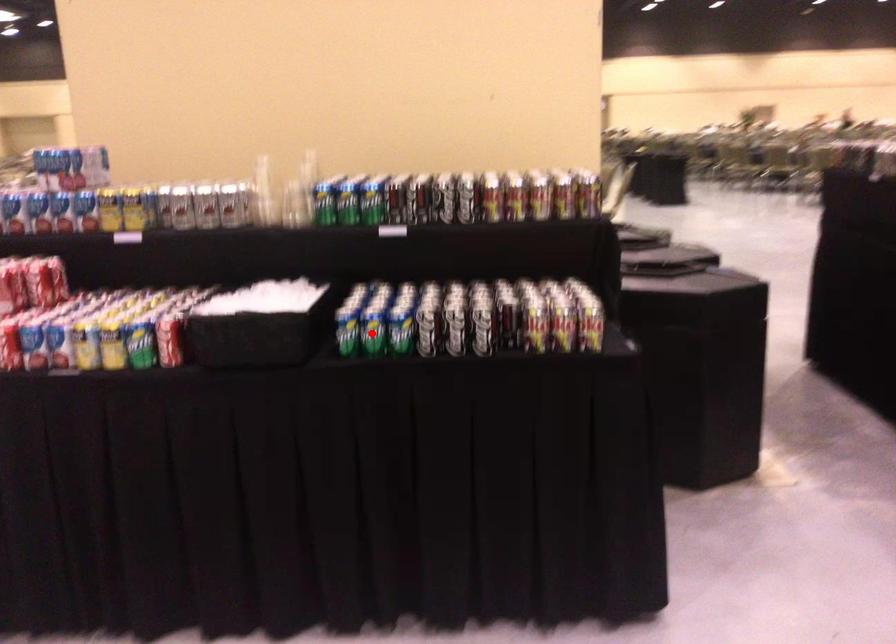
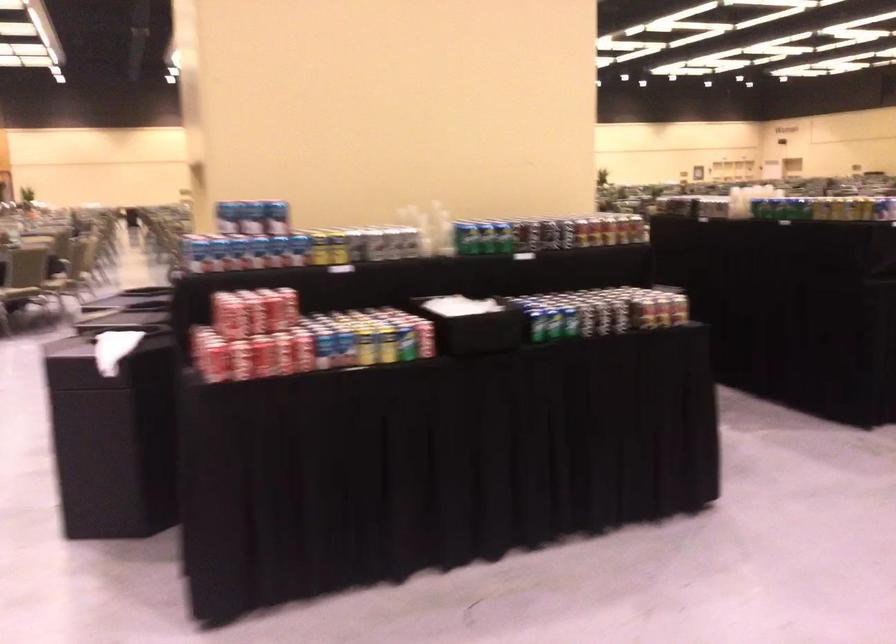
Locate, in the second image, the point that corresponds to the highlighted location in the first image.

(556, 323)